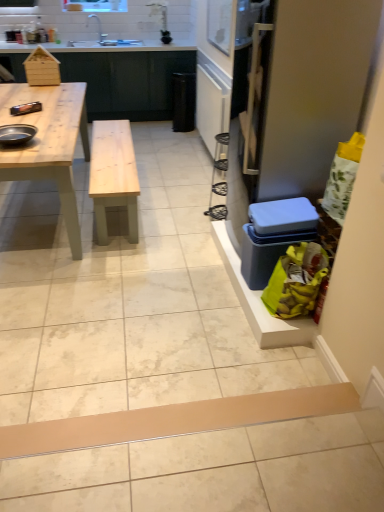
Question: Is shiny black pan at left at the left side of white ceramic sink at upper center?

Choices:
 (A) yes
 (B) no

Answer: (A)

Question: Does shiny black pan at left have a smaller size compared to white ceramic sink at upper center?

Choices:
 (A) yes
 (B) no

Answer: (A)

Question: Is shiny black pan at left not close to white ceramic sink at upper center?

Choices:
 (A) yes
 (B) no

Answer: (A)

Question: From the image's perspective, does shiny black pan at left appear lower than white ceramic sink at upper center?

Choices:
 (A) yes
 (B) no

Answer: (A)

Question: Is shiny black pan at left facing towards white ceramic sink at upper center?

Choices:
 (A) yes
 (B) no

Answer: (A)

Question: Can you confirm if shiny black pan at left is bigger than white ceramic sink at upper center?

Choices:
 (A) yes
 (B) no

Answer: (B)

Question: Would you say shiny black pan at left contains clear plastic screen door at right?

Choices:
 (A) no
 (B) yes

Answer: (A)

Question: Is shiny black pan at left touching clear plastic screen door at right?

Choices:
 (A) yes
 (B) no

Answer: (B)

Question: Considering the relative sizes of shiny black pan at left and clear plastic screen door at right in the image provided, is shiny black pan at left thinner than clear plastic screen door at right?

Choices:
 (A) yes
 (B) no

Answer: (A)

Question: From the image's perspective, is shiny black pan at left below clear plastic screen door at right?

Choices:
 (A) yes
 (B) no

Answer: (B)

Question: From the image's perspective, is shiny black pan at left over clear plastic screen door at right?

Choices:
 (A) no
 (B) yes

Answer: (B)

Question: Is shiny black pan at left facing towards clear plastic screen door at right?

Choices:
 (A) yes
 (B) no

Answer: (B)

Question: From the image's perspective, would you say shiny black pan at left is positioned over brown cardboard plank at lower center?

Choices:
 (A) yes
 (B) no

Answer: (A)